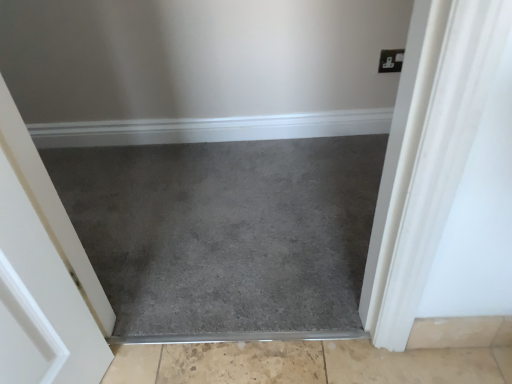
This screenshot has height=384, width=512. Describe the element at coordinates (306, 364) in the screenshot. I see `beige textured concrete at bottom, the 1th concrete in the bottom-to-top sequence` at that location.

Locate an element on the screen. Image resolution: width=512 pixels, height=384 pixels. beige tile at lower right, which ranks as the second concrete in bottom-to-top order is located at coordinates (461, 332).

The height and width of the screenshot is (384, 512). What do you see at coordinates (461, 332) in the screenshot?
I see `beige tile at lower right, the 1th concrete in the top-to-bottom sequence` at bounding box center [461, 332].

Describe the element at coordinates (226, 234) in the screenshot. This screenshot has height=384, width=512. I see `slate carpet at center` at that location.

I want to click on beige textured concrete at bottom, positioned as the 2th concrete in top-to-bottom order, so click(306, 364).

Locate an element on the screen. Image resolution: width=512 pixels, height=384 pixels. slate on the left of beige textured concrete at bottom, the 1th concrete in the bottom-to-top sequence is located at coordinates [226, 234].

Is slate carpet at center inside the boundaries of beige textured concrete at bottom, positioned as the 2th concrete in top-to-bottom order, or outside?

slate carpet at center is not inside beige textured concrete at bottom, positioned as the 2th concrete in top-to-bottom order, it's outside.

Is slate carpet at center aimed at beige textured concrete at bottom, positioned as the 2th concrete in top-to-bottom order?

Yes, slate carpet at center is oriented towards beige textured concrete at bottom, positioned as the 2th concrete in top-to-bottom order.

Does point (168, 272) come behind point (498, 381)?

Yes, it is.

Is beige textured concrete at bottom, positioned as the 2th concrete in top-to-bottom order, far from beige tile at lower right, the 1th concrete in the top-to-bottom sequence?

They are positioned close to each other.

From a real-world perspective, between beige textured concrete at bottom, positioned as the 2th concrete in top-to-bottom order, and beige tile at lower right, the 1th concrete in the top-to-bottom sequence, who is vertically higher?

From a 3D spatial view, beige tile at lower right, the 1th concrete in the top-to-bottom sequence, is above.

Is beige textured concrete at bottom, the 1th concrete in the bottom-to-top sequence, to the left of beige tile at lower right, the 1th concrete in the top-to-bottom sequence, from the viewer's perspective?

Yes, beige textured concrete at bottom, the 1th concrete in the bottom-to-top sequence, is to the left of beige tile at lower right, the 1th concrete in the top-to-bottom sequence.

Which is in front, point (426, 355) or point (429, 345)?

The point (429, 345) is in front.

Is beige tile at lower right, the 1th concrete in the top-to-bottom sequence, positioned beyond the bounds of beige textured concrete at bottom, positioned as the 2th concrete in top-to-bottom order?

beige tile at lower right, the 1th concrete in the top-to-bottom sequence, lies outside beige textured concrete at bottom, positioned as the 2th concrete in top-to-bottom order,'s area.

Is beige tile at lower right, which ranks as the second concrete in bottom-to-top order, taller than beige textured concrete at bottom, positioned as the 2th concrete in top-to-bottom order?

Yes.

From the image's perspective, is beige tile at lower right, the 1th concrete in the top-to-bottom sequence, above or below beige textured concrete at bottom, positioned as the 2th concrete in top-to-bottom order?

From the image's perspective, beige tile at lower right, the 1th concrete in the top-to-bottom sequence, appears above beige textured concrete at bottom, positioned as the 2th concrete in top-to-bottom order.

Considering the relative positions of beige tile at lower right, which ranks as the second concrete in bottom-to-top order, and beige textured concrete at bottom, positioned as the 2th concrete in top-to-bottom order, in the image provided, is beige tile at lower right, which ranks as the second concrete in bottom-to-top order, to the left of beige textured concrete at bottom, positioned as the 2th concrete in top-to-bottom order, from the viewer's perspective?

No.

Is beige tile at lower right, the 1th concrete in the top-to-bottom sequence, inside the boundaries of slate carpet at center, or outside?

beige tile at lower right, the 1th concrete in the top-to-bottom sequence, is outside slate carpet at center.

In terms of height, does beige tile at lower right, which ranks as the second concrete in bottom-to-top order, look taller or shorter compared to slate carpet at center?

beige tile at lower right, which ranks as the second concrete in bottom-to-top order, is taller than slate carpet at center.

How distant is beige tile at lower right, which ranks as the second concrete in bottom-to-top order, from slate carpet at center?

A distance of 28.13 inches exists between beige tile at lower right, which ranks as the second concrete in bottom-to-top order, and slate carpet at center.

Based on the photo, considering the sizes of beige tile at lower right, the 1th concrete in the top-to-bottom sequence, and slate carpet at center in the image, is beige tile at lower right, the 1th concrete in the top-to-bottom sequence, wider or thinner than slate carpet at center?

Clearly, beige tile at lower right, the 1th concrete in the top-to-bottom sequence, has less width compared to slate carpet at center.

Can you confirm if beige textured concrete at bottom, positioned as the 2th concrete in top-to-bottom order, is wider than slate carpet at center?

No.

Can you tell me how much beige textured concrete at bottom, the 1th concrete in the bottom-to-top sequence, and slate carpet at center differ in facing direction?

The facing directions of beige textured concrete at bottom, the 1th concrete in the bottom-to-top sequence, and slate carpet at center are 180 degrees apart.

From the image's perspective, relative to slate carpet at center, is beige textured concrete at bottom, positioned as the 2th concrete in top-to-bottom order, above or below?

Clearly, from the image's perspective, beige textured concrete at bottom, positioned as the 2th concrete in top-to-bottom order, is below slate carpet at center.

Which point is more distant from viewer, [423,373] or [231,305]?

The point [231,305] is farther.

Is slate carpet at center aimed at beige tile at lower right, which ranks as the second concrete in bottom-to-top order?

No, slate carpet at center is not oriented towards beige tile at lower right, which ranks as the second concrete in bottom-to-top order.

Find the location of a particular element. Image resolution: width=512 pixels, height=384 pixels. slate behind the beige tile at lower right, which ranks as the second concrete in bottom-to-top order is located at coordinates (226, 234).

From the image's perspective, which one is positioned lower, slate carpet at center or beige tile at lower right, which ranks as the second concrete in bottom-to-top order?

beige tile at lower right, which ranks as the second concrete in bottom-to-top order, appears lower in the image.

Is beige tile at lower right, the 1th concrete in the top-to-bottom sequence, located within slate carpet at center?

No, beige tile at lower right, the 1th concrete in the top-to-bottom sequence, is not surrounded by slate carpet at center.

At what (x,y) coordinates should I click in order to perform the action: click on slate above the beige textured concrete at bottom, the 1th concrete in the bottom-to-top sequence (from a real-world perspective). Please return your answer as a coordinate pair (x, y). The height and width of the screenshot is (384, 512). Looking at the image, I should click on (226, 234).

You are a GUI agent. You are given a task and a screenshot of the screen. Output one action in this format:
    pyautogui.click(x=<x>, y=<y>)
    Task: Click on the concrete that is below the beige tile at lower right, the 1th concrete in the top-to-bottom sequence (from the image's perspective)
    This screenshot has height=384, width=512.
    Given the screenshot: What is the action you would take?
    point(306,364)

Looking at the image, which one is located further to slate carpet at center, beige tile at lower right, the 1th concrete in the top-to-bottom sequence, or beige textured concrete at bottom, the 1th concrete in the bottom-to-top sequence?

beige tile at lower right, the 1th concrete in the top-to-bottom sequence, lies further to slate carpet at center than the other object.

When comparing their distances from beige textured concrete at bottom, the 1th concrete in the bottom-to-top sequence, does slate carpet at center or beige tile at lower right, the 1th concrete in the top-to-bottom sequence, seem further?

slate carpet at center is positioned further to the anchor beige textured concrete at bottom, the 1th concrete in the bottom-to-top sequence.

Looking at the image, which one is located further to beige textured concrete at bottom, the 1th concrete in the bottom-to-top sequence, beige tile at lower right, the 1th concrete in the top-to-bottom sequence, or slate carpet at center?

slate carpet at center is positioned further to the anchor beige textured concrete at bottom, the 1th concrete in the bottom-to-top sequence.

Which object lies further to the anchor point beige tile at lower right, which ranks as the second concrete in bottom-to-top order, beige textured concrete at bottom, the 1th concrete in the bottom-to-top sequence, or slate carpet at center?

slate carpet at center.

Based on their spatial positions, is beige textured concrete at bottom, positioned as the 2th concrete in top-to-bottom order, or beige tile at lower right, which ranks as the second concrete in bottom-to-top order, further from slate carpet at center?

Based on the image, beige tile at lower right, which ranks as the second concrete in bottom-to-top order, appears to be further to slate carpet at center.

When comparing their distances from beige tile at lower right, which ranks as the second concrete in bottom-to-top order, does slate carpet at center or beige textured concrete at bottom, positioned as the 2th concrete in top-to-bottom order, seem further?

Among the two, slate carpet at center is located further to beige tile at lower right, which ranks as the second concrete in bottom-to-top order.

Identify the location of concrete situated between slate carpet at center and beige tile at lower right, the 1th concrete in the top-to-bottom sequence, from left to right. The image size is (512, 384). [306, 364].